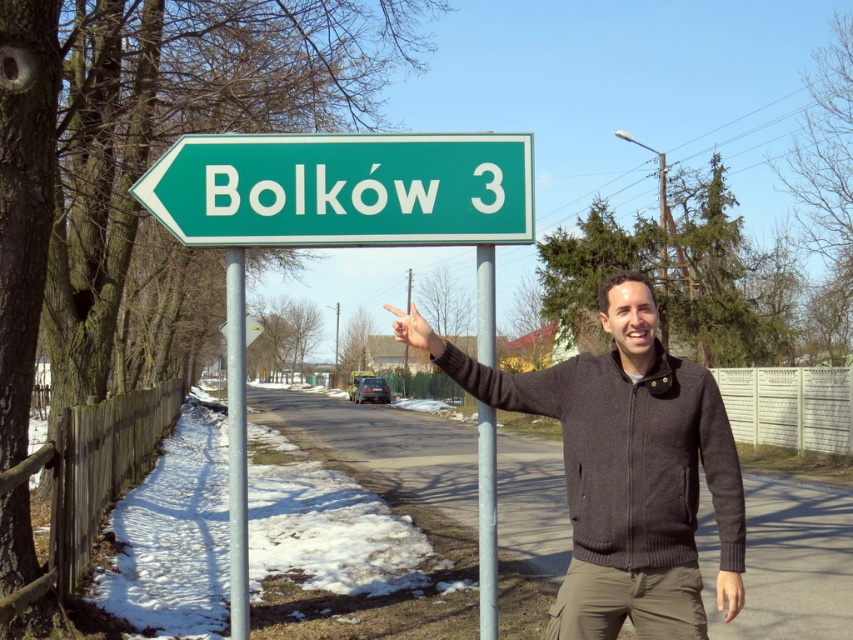
You are a pedestrian standing on the road and see the metallic gray pole at center and the green plastic sign at upper left. Which object is closer to your feet?

The metallic gray pole at center is closer to your feet because it is positioned under the green plastic sign at upper left, meaning it is lower in position.

You are a delivery driver approaching the road sign and need to know if you can safely pass between the metallic pole at left and the green plastic sign at upper left without hitting either. Can you confirm if there is enough vertical clearance for your vehicle?

The metallic pole at left is much taller than the green plastic sign at upper left, so there should be sufficient vertical clearance for your vehicle to pass safely between them without hitting either object.

You are a delivery driver who needs to know the height of the green plastic sign at left and the metallic gray pole at center to ensure your truck can pass under them. According to the scene description, which object is shorter?

The green plastic sign at left is shorter than the metallic gray pole at center.